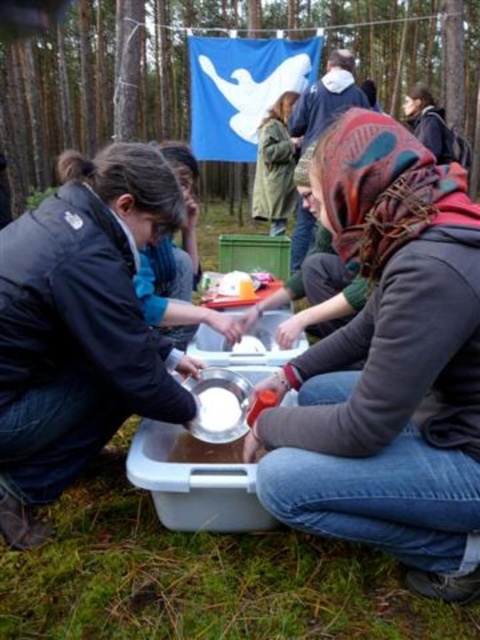
Question: Does green matte jacket at center have a lesser width compared to white matte bowl at center?

Choices:
 (A) yes
 (B) no

Answer: (B)

Question: Among these points, which one is farthest from the camera?

Choices:
 (A) (200, 397)
 (B) (349, 476)
 (C) (287, 164)

Answer: (C)

Question: Which of the following is the farthest from the observer?

Choices:
 (A) click(223, 400)
 (B) click(403, 336)
 (C) click(52, 252)

Answer: (A)

Question: Can you confirm if matte black jacket at lower left is thinner than white matte bowl at center?

Choices:
 (A) yes
 (B) no

Answer: (B)

Question: Which object is positioned closest to the white matte bowl at center?

Choices:
 (A) matte gray hoodie at center
 (B) green matte jacket at center

Answer: (A)

Question: Does matte gray hoodie at center lie in front of green matte jacket at center?

Choices:
 (A) yes
 (B) no

Answer: (A)